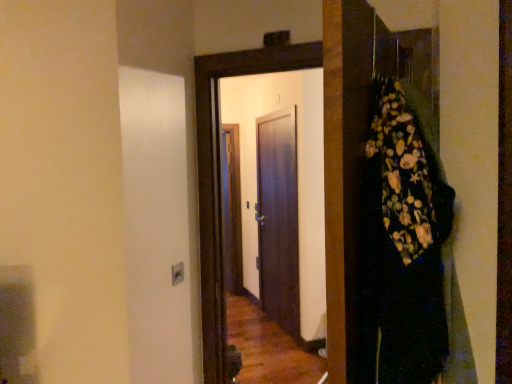
Find the location of a particular element. dark wood door at center, the first door in the back-to-front sequence is located at coordinates (278, 220).

Choose the correct answer: Is floral-patterned fabric at right inside dark wood door at center, the first door viewed from the front, or outside it?

The correct answer is: outside.

Can you confirm if floral-patterned fabric at right is positioned to the right of dark wood door at center, the first door viewed from the front?

Correct, you'll find floral-patterned fabric at right to the right of dark wood door at center, the first door viewed from the front.

Could you tell me if floral-patterned fabric at right is facing dark wood door at center, acting as the second door starting from the back?

No, floral-patterned fabric at right is not facing towards dark wood door at center, acting as the second door starting from the back.

Which is in front, point (406, 254) or point (218, 91)?

The point (406, 254) is closer.

Where is `dress above the dark wood door at center, the first door viewed from the front (from the image's perspective)`? This screenshot has height=384, width=512. dress above the dark wood door at center, the first door viewed from the front (from the image's perspective) is located at coordinates (402, 243).

Considering the sizes of dark wood door at center, the first door viewed from the front, and floral-patterned fabric at right in the image, is dark wood door at center, the first door viewed from the front, taller or shorter than floral-patterned fabric at right?

In the image, dark wood door at center, the first door viewed from the front, appears to be taller than floral-patterned fabric at right.

From the image's perspective, is dark wood door at center, the first door viewed from the front, located above floral-patterned fabric at right?

Incorrect, from the image's perspective, dark wood door at center, the first door viewed from the front, is lower than floral-patterned fabric at right.

Is floral-patterned fabric at right closer to the viewer compared to dark wood door at center, which is counted as the 2th door, starting from the front?

Yes, floral-patterned fabric at right is in front of dark wood door at center, which is counted as the 2th door, starting from the front.

From a real-world perspective, which object rests below the other?

In real-world perspective, dark wood door at center, which is counted as the 2th door, starting from the front, is lower.

Is floral-patterned fabric at right far away from dark wood door at center, the first door in the back-to-front sequence?

That's right, there is a large distance between floral-patterned fabric at right and dark wood door at center, the first door in the back-to-front sequence.

Between point (435, 310) and point (274, 285), which one is positioned behind?

Positioned behind is point (274, 285).

Is dark wood door at center, the first door viewed from the front, to the right of dark wood door at center, which is counted as the 2th door, starting from the front, from the viewer's perspective?

Incorrect, dark wood door at center, the first door viewed from the front, is not on the right side of dark wood door at center, which is counted as the 2th door, starting from the front.

In terms of height, does dark wood door at center, the first door viewed from the front, look taller or shorter compared to dark wood door at center, the first door in the back-to-front sequence?

Clearly, dark wood door at center, the first door viewed from the front, is shorter compared to dark wood door at center, the first door in the back-to-front sequence.

Is dark wood door at center, the first door viewed from the front, further to camera compared to dark wood door at center, the first door in the back-to-front sequence?

No.

Is dark wood door at center, which is counted as the 2th door, starting from the front, positioned with its back to dark wood door at center, the first door viewed from the front?

No, dark wood door at center, the first door viewed from the front, is not at the back of dark wood door at center, which is counted as the 2th door, starting from the front.

Between dark wood door at center, the first door in the back-to-front sequence, and dark wood door at center, acting as the second door starting from the back, which one appears on the right side from the viewer's perspective?

From the viewer's perspective, dark wood door at center, the first door in the back-to-front sequence, appears more on the right side.

Considering the sizes of dark wood door at center, the first door in the back-to-front sequence, and dark wood door at center, acting as the second door starting from the back, in the image, is dark wood door at center, the first door in the back-to-front sequence, wider or thinner than dark wood door at center, acting as the second door starting from the back,?

Considering their sizes, dark wood door at center, the first door in the back-to-front sequence, looks slimmer than dark wood door at center, acting as the second door starting from the back.

Is dark wood door at center, which is counted as the 2th door, starting from the front, inside the boundaries of dark wood door at center, the first door viewed from the front, or outside?

dark wood door at center, which is counted as the 2th door, starting from the front, is not enclosed by dark wood door at center, the first door viewed from the front.

Is dark wood door at center, the first door in the back-to-front sequence, smaller than floral-patterned fabric at right?

Incorrect, dark wood door at center, the first door in the back-to-front sequence, is not smaller in size than floral-patterned fabric at right.

How different are the orientations of dark wood door at center, the first door in the back-to-front sequence, and floral-patterned fabric at right in degrees?

134 degrees separate the facing orientations of dark wood door at center, the first door in the back-to-front sequence, and floral-patterned fabric at right.

Are dark wood door at center, the first door in the back-to-front sequence, and floral-patterned fabric at right far apart?

dark wood door at center, the first door in the back-to-front sequence, is far away from floral-patterned fabric at right.

Would you say floral-patterned fabric at right is part of dark wood door at center, which is counted as the 2th door, starting from the front,'s contents?

No.

At what (x,y) coordinates should I click in order to perform the action: click on the 1st door below the floral-patterned fabric at right (from the image's perspective). Please return your answer as a coordinate pair (x, y). This screenshot has height=384, width=512. Looking at the image, I should click on (219, 173).

This screenshot has height=384, width=512. In the image, there is a dark wood door at center, acting as the second door starting from the back. Find the location of `dress above it (from the image's perspective)`. dress above it (from the image's perspective) is located at coordinates (402, 243).

Estimate the real-world distances between objects in this image. Which object is closer to dark wood door at center, acting as the second door starting from the back, dark wood door at center, the first door in the back-to-front sequence, or floral-patterned fabric at right?

The object closer to dark wood door at center, acting as the second door starting from the back, is floral-patterned fabric at right.

Considering their positions, is dark wood door at center, the first door viewed from the front, positioned closer to dark wood door at center, which is counted as the 2th door, starting from the front, than floral-patterned fabric at right?

dark wood door at center, the first door viewed from the front, lies closer to dark wood door at center, which is counted as the 2th door, starting from the front, than the other object.

Based on their spatial positions, is dark wood door at center, acting as the second door starting from the back, or dark wood door at center, the first door in the back-to-front sequence, closer to floral-patterned fabric at right?

dark wood door at center, acting as the second door starting from the back, lies closer to floral-patterned fabric at right than the other object.

Which object lies nearer to the anchor point dark wood door at center, the first door viewed from the front, floral-patterned fabric at right or dark wood door at center, the first door in the back-to-front sequence?

Based on the image, floral-patterned fabric at right appears to be nearer to dark wood door at center, the first door viewed from the front.

From the image, which object appears to be farther from floral-patterned fabric at right, dark wood door at center, the first door in the back-to-front sequence, or dark wood door at center, the first door viewed from the front?

dark wood door at center, the first door in the back-to-front sequence, lies further to floral-patterned fabric at right than the other object.

When comparing their distances from dark wood door at center, which is counted as the 2th door, starting from the front, does floral-patterned fabric at right or dark wood door at center, the first door viewed from the front, seem further?

The object further to dark wood door at center, which is counted as the 2th door, starting from the front, is floral-patterned fabric at right.

The height and width of the screenshot is (384, 512). I want to click on door between floral-patterned fabric at right and dark wood door at center, the first door in the back-to-front sequence, in the front-back direction, so click(219, 173).